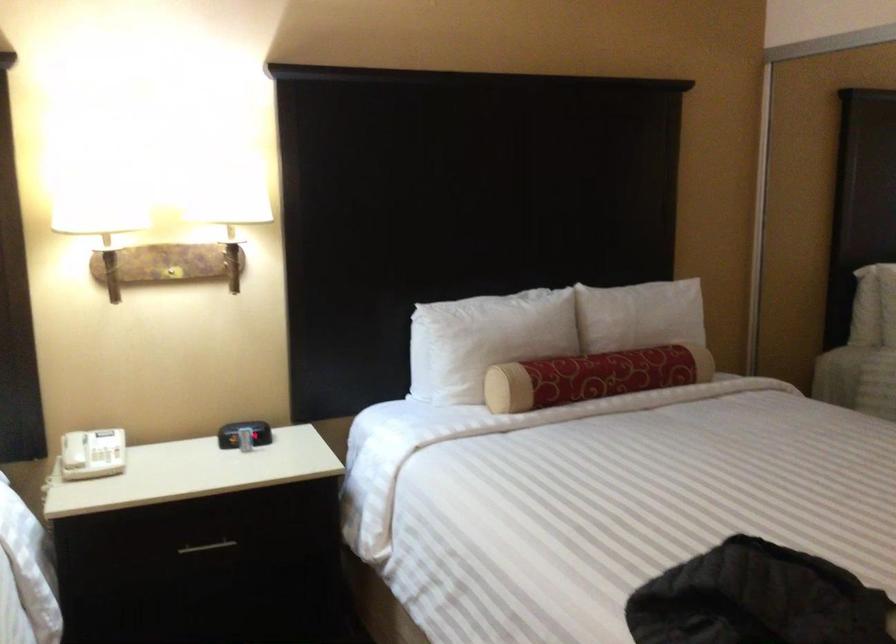
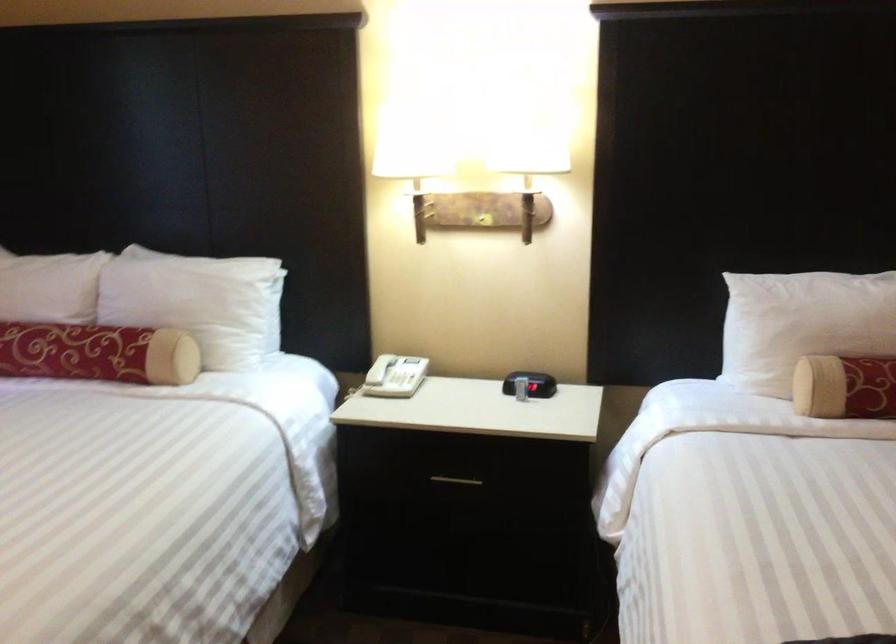
Find the pixel in the second image that matches (168,276) in the first image.

(483, 220)